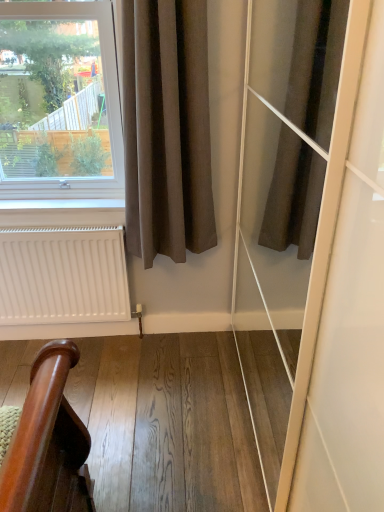
This screenshot has width=384, height=512. I want to click on free space in front of white matte radiator at lower left, so click(84, 396).